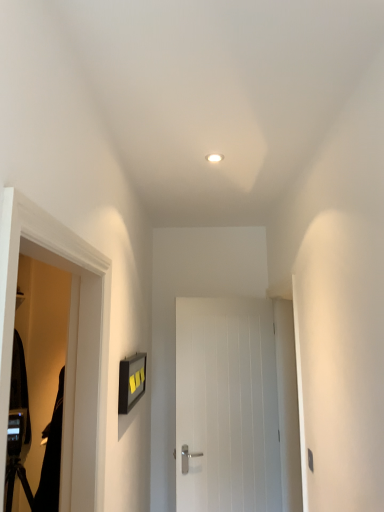
Locate an element on the screen. black matte robe at left is located at coordinates (51, 458).

Identify the location of white matte light fixture at upper center. Image resolution: width=384 pixels, height=512 pixels. (214, 158).

What do you see at coordinates (214, 158) in the screenshot? I see `white matte light fixture at upper center` at bounding box center [214, 158].

Image resolution: width=384 pixels, height=512 pixels. Describe the element at coordinates (226, 406) in the screenshot. I see `white wooden door at center` at that location.

Locate an element on the screen. black matte robe at left is located at coordinates [51, 458].

Is white wooden door at center facing towards black matte robe at left?

No, white wooden door at center is not oriented towards black matte robe at left.

Does point (277, 416) lie behind point (51, 476)?

Yes.

Locate an element on the screen. The height and width of the screenshot is (512, 384). door positioned vertically above the black matte robe at left (from a real-world perspective) is located at coordinates (226, 406).

Which object is wider, white wooden door at center or black matte robe at left?

With larger width is black matte robe at left.

From a real-world perspective, which is physically below, white matte light fixture at upper center or white wooden door at center?

white wooden door at center, from a real-world perspective.

Is white matte light fixture at upper center far away from white wooden door at center?

That's right, there is a large distance between white matte light fixture at upper center and white wooden door at center.

Is white matte light fixture at upper center aimed at white wooden door at center?

No, white matte light fixture at upper center is not facing towards white wooden door at center.

From the image's perspective, is white matte light fixture at upper center located above white wooden door at center?

Yes, from the image's perspective, white matte light fixture at upper center is over white wooden door at center.

Which of these two, white wooden door at center or black matte screen door at left, stands shorter?

black matte screen door at left is shorter.

Is white wooden door at center positioned far away from black matte screen door at left?

Yes.

Is white wooden door at center spatially inside black matte screen door at left, or outside of it?

white wooden door at center is spatially situated outside black matte screen door at left.

Find the location of `robe below the white matte light fixture at upper center (from a real-world perspective)`. robe below the white matte light fixture at upper center (from a real-world perspective) is located at coordinates (51, 458).

Is black matte robe at left aimed at white matte light fixture at upper center?

No, black matte robe at left is not oriented towards white matte light fixture at upper center.

Is black matte robe at left with white matte light fixture at upper center?

No, black matte robe at left is not beside white matte light fixture at upper center.

Which of these two, black matte robe at left or white matte light fixture at upper center, is bigger?

black matte robe at left.

Is white wooden door at center directly adjacent to white matte light fixture at upper center?

No.

Does white wooden door at center lie in front of white matte light fixture at upper center?

No, the depth of white wooden door at center is greater than that of white matte light fixture at upper center.

From a real-world perspective, which object rests below the other?

white wooden door at center.

Considering the relative positions of white matte light fixture at upper center and black matte screen door at left in the image provided, is white matte light fixture at upper center to the right of black matte screen door at left from the viewer's perspective?

Correct, you'll find white matte light fixture at upper center to the right of black matte screen door at left.

Can we say white matte light fixture at upper center lies outside black matte screen door at left?

white matte light fixture at upper center lies outside black matte screen door at left's area.

Between white matte light fixture at upper center and black matte screen door at left, which one has smaller width?

Thinner between the two is white matte light fixture at upper center.

Would you say black matte screen door at left is a long distance from white wooden door at center?

Yes, black matte screen door at left and white wooden door at center are quite far apart.

In the scene shown: Is black matte screen door at left inside or outside of white wooden door at center?

black matte screen door at left is not enclosed by white wooden door at center.

Which of these two, black matte screen door at left or white wooden door at center, stands shorter?

black matte screen door at left is shorter.

Is black matte screen door at left positioned before white wooden door at center?

Yes, black matte screen door at left is closer to the viewer.

The width and height of the screenshot is (384, 512). I want to click on robe that is in front of the white wooden door at center, so click(x=51, y=458).

Find the location of `lighting that is above the white wooden door at center (from the image's perspective)`. lighting that is above the white wooden door at center (from the image's perspective) is located at coordinates (214, 158).

Looking at the image, which one is located closer to white matte light fixture at upper center, white wooden door at center or black matte robe at left?

black matte robe at left.

When comparing their distances from black matte screen door at left, does white wooden door at center or white matte light fixture at upper center seem closer?

The object closer to black matte screen door at left is white matte light fixture at upper center.

From the image, which object appears to be farther from black matte robe at left, white matte light fixture at upper center or black matte screen door at left?

white matte light fixture at upper center is further to black matte robe at left.

Estimate the real-world distances between objects in this image. Which object is closer to black matte robe at left, black matte screen door at left or white wooden door at center?

black matte screen door at left lies closer to black matte robe at left than the other object.

In the scene shown: Considering their positions, is white wooden door at center positioned further to black matte screen door at left than black matte robe at left?

white wooden door at center is further to black matte screen door at left.

Considering their positions, is white wooden door at center positioned closer to black matte robe at left than white matte light fixture at upper center?

white wooden door at center is closer to black matte robe at left.

Looking at the image, which one is located further to white wooden door at center, black matte screen door at left or black matte robe at left?

Among the two, black matte screen door at left is located further to white wooden door at center.

Estimate the real-world distances between objects in this image. Which object is closer to black matte robe at left, black matte screen door at left or white matte light fixture at upper center?

black matte screen door at left lies closer to black matte robe at left than the other object.

Find the location of a particular element. lighting between black matte screen door at left and white wooden door at center from front to back is located at coordinates (214, 158).

Find the location of a particular element. The width and height of the screenshot is (384, 512). screen door between white matte light fixture at upper center and black matte robe at left in the vertical direction is located at coordinates (79, 381).

You are a GUI agent. You are given a task and a screenshot of the screen. Output one action in this format:
    pyautogui.click(x=<x>, y=<y>)
    Task: Click on the robe located between black matte screen door at left and white wooden door at center in the depth direction
    
    Given the screenshot: What is the action you would take?
    click(x=51, y=458)

What are the coordinates of `robe between white matte light fixture at upper center and white wooden door at center in the up-down direction` in the screenshot? It's located at (51, 458).